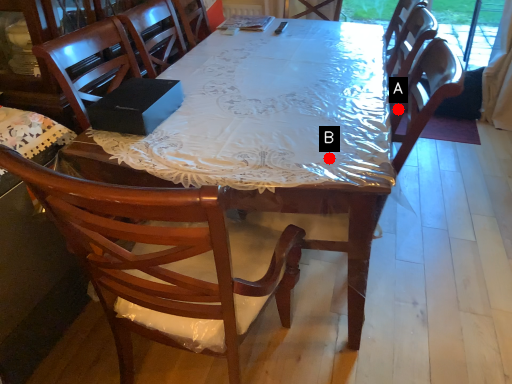
Question: Two points are circled on the image, labeled by A and B beside each circle. Which of the following is the closest to the observer?

Choices:
 (A) A is closer
 (B) B is closer

Answer: (B)